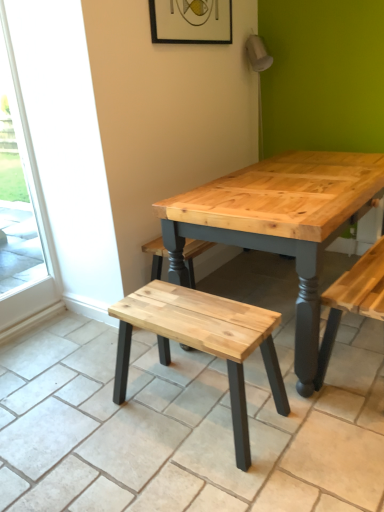
This screenshot has height=512, width=384. Identify the location of vacant space that is to the left of natural wood stool at center. (89, 423).